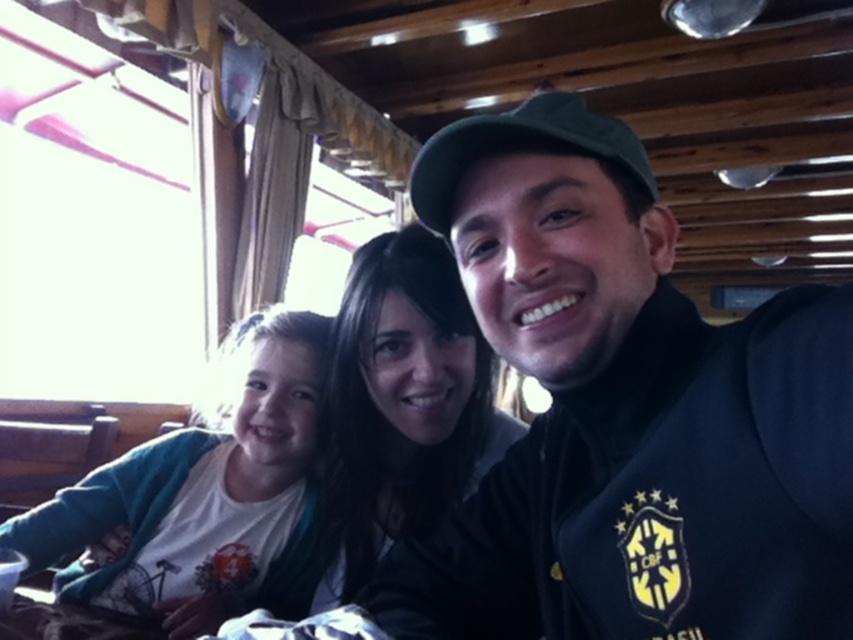
From the picture: Does white cotton shirt at left lie behind matte black jacket at center?

Yes, it is behind matte black jacket at center.

Is white cotton shirt at left closer to camera compared to matte black jacket at center?

That is False.

At what (x,y) coordinates should I click in order to perform the action: click on white cotton shirt at left. Please return your answer as a coordinate pair (x, y). Image resolution: width=853 pixels, height=640 pixels. Looking at the image, I should click on click(201, 506).

What are the coordinates of `white cotton shirt at left` in the screenshot? It's located at (201, 506).

Can you confirm if dark blue fleece at center is positioned above white cotton shirt at left?

Indeed, dark blue fleece at center is positioned over white cotton shirt at left.

Is the position of dark blue fleece at center less distant than that of white cotton shirt at left?

Yes.

The width and height of the screenshot is (853, 640). In order to click on dark blue fleece at center in this screenshot , I will do `click(625, 413)`.

How much distance is there between dark blue fleece at center and matte black jacket at center?

dark blue fleece at center is 25.40 centimeters away from matte black jacket at center.

Is point (724, 342) more distant than point (450, 488)?

No.

Which is in front, point (503, 323) or point (349, 548)?

Point (503, 323) is more forward.

Image resolution: width=853 pixels, height=640 pixels. I want to click on dark blue fleece at center, so (625, 413).